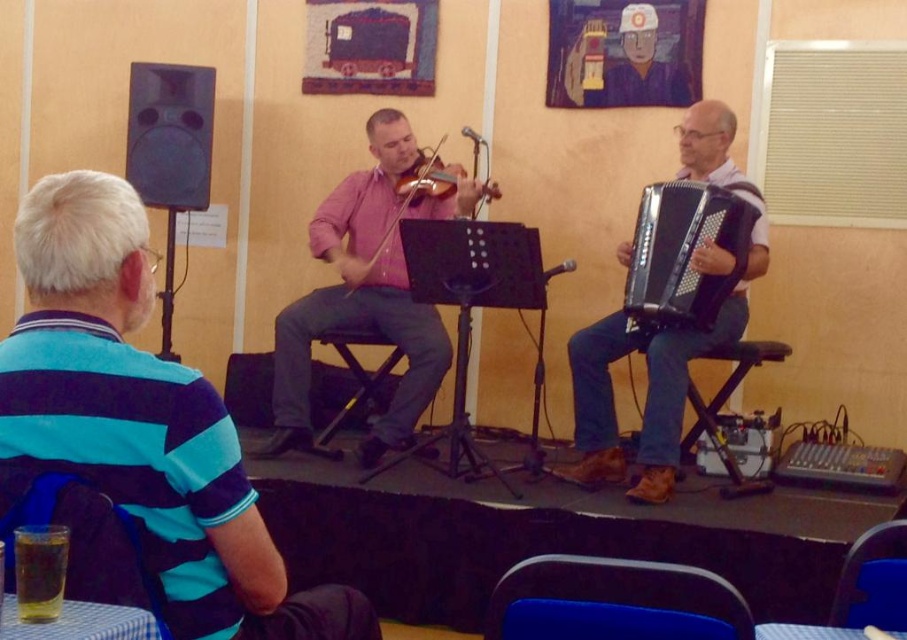
Question: Which point is closer to the camera?

Choices:
 (A) (258, 592)
 (B) (408, 198)
 (C) (393, 401)

Answer: (A)

Question: Considering the relative positions of blue striped shirt at left and pink matte violinist at center in the image provided, where is blue striped shirt at left located with respect to pink matte violinist at center?

Choices:
 (A) left
 (B) right

Answer: (A)

Question: Which point is farther from the camera taking this photo?

Choices:
 (A) [x=378, y=205]
 (B) [x=662, y=289]

Answer: (A)

Question: Can you confirm if pink matte violinist at center is positioned above black plastic accordion at right?

Choices:
 (A) no
 (B) yes

Answer: (B)

Question: Can you confirm if pink matte violinist at center is positioned to the left of matte wood violin at center?

Choices:
 (A) yes
 (B) no

Answer: (A)

Question: Among these objects, which one is farthest from the camera?

Choices:
 (A) pink matte violinist at center
 (B) matte wood violin at center
 (C) black plastic accordion at right

Answer: (B)